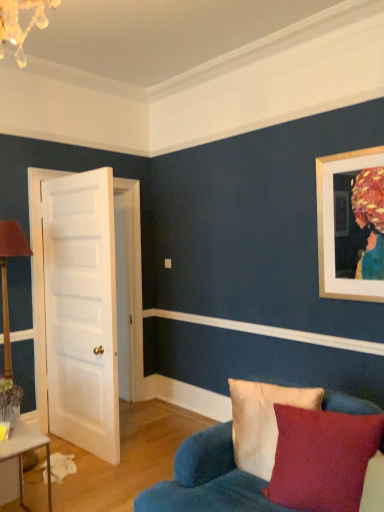
This screenshot has width=384, height=512. Identify the location of free location in front of white smooth door at left. (94, 485).